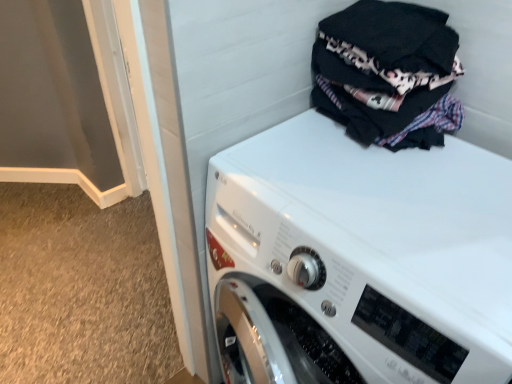
Locate an element on the screen. This screenshot has width=512, height=384. vacant area that is in front of black cotton laundry at upper right is located at coordinates (393, 190).